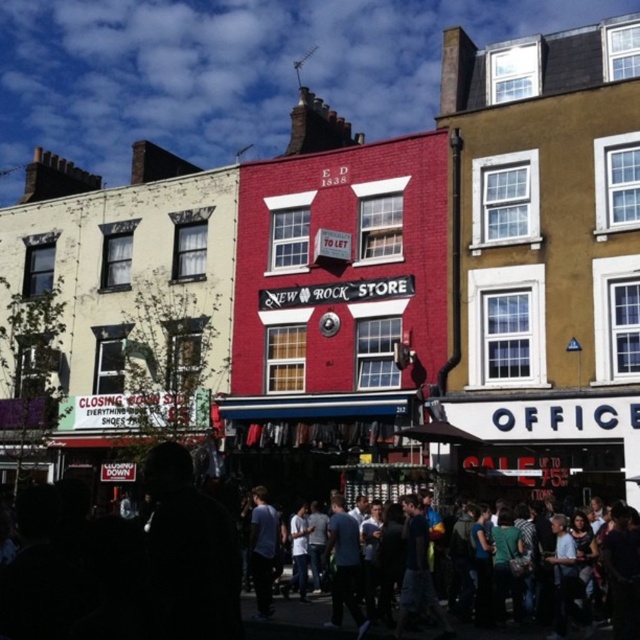
Looking at this image, measure the distance between dark clothing crowd at center and light blue jeans at center.

11.74 meters

Which is more to the right, dark clothing crowd at center or light blue jeans at center?

dark clothing crowd at center

Is point (152, 516) farther from camera compared to point (260, 497)?

No, (152, 516) is closer to viewer.

Locate an element on the screen. dark clothing crowd at center is located at coordinates (136, 572).